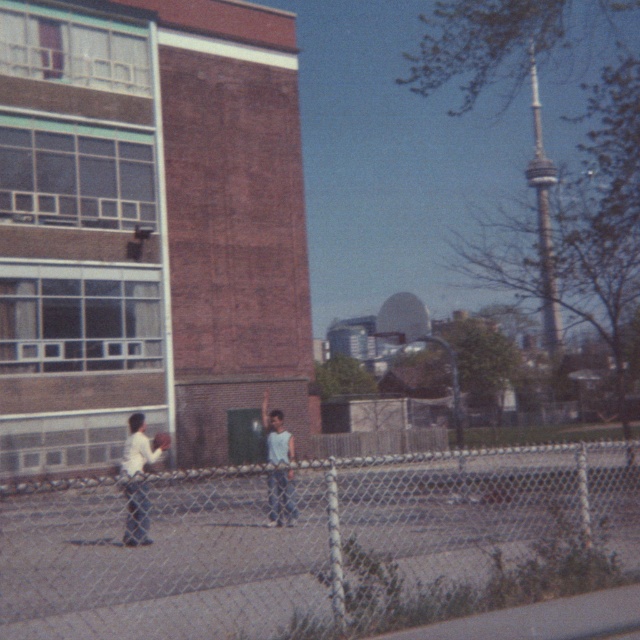
Question: Among these objects, which one is farthest from the camera?

Choices:
 (A) metal chain-link fence at lower center
 (B) white matte basketball at left
 (C) light blue t-shirt at center

Answer: (B)

Question: Which of these objects is positioned closest to the metal chain-link fence at lower center?

Choices:
 (A) white matte basketball at left
 (B) light blue t-shirt at center

Answer: (B)

Question: Can you confirm if metal chain-link fence at lower center is positioned to the left of light blue t-shirt at center?

Choices:
 (A) no
 (B) yes

Answer: (A)

Question: Which of the following is the closest to the observer?

Choices:
 (A) (42, 560)
 (B) (132, 452)

Answer: (A)

Question: Is metal chain-link fence at lower center wider than light blue t-shirt at center?

Choices:
 (A) no
 (B) yes

Answer: (B)

Question: In this image, where is metal chain-link fence at lower center located relative to light blue t-shirt at center?

Choices:
 (A) below
 (B) above

Answer: (A)